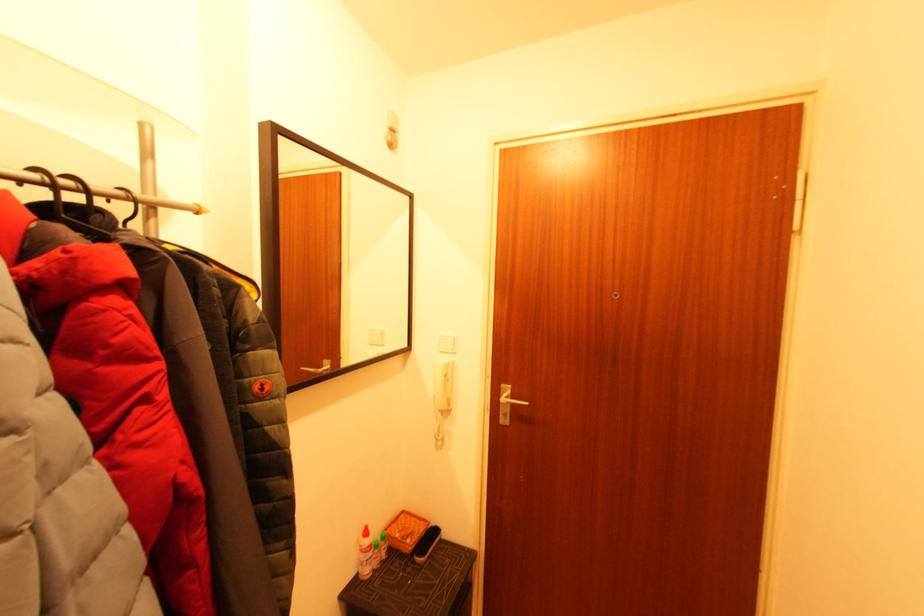
The image size is (924, 616). What do you see at coordinates (506, 403) in the screenshot? I see `the silver door handle` at bounding box center [506, 403].